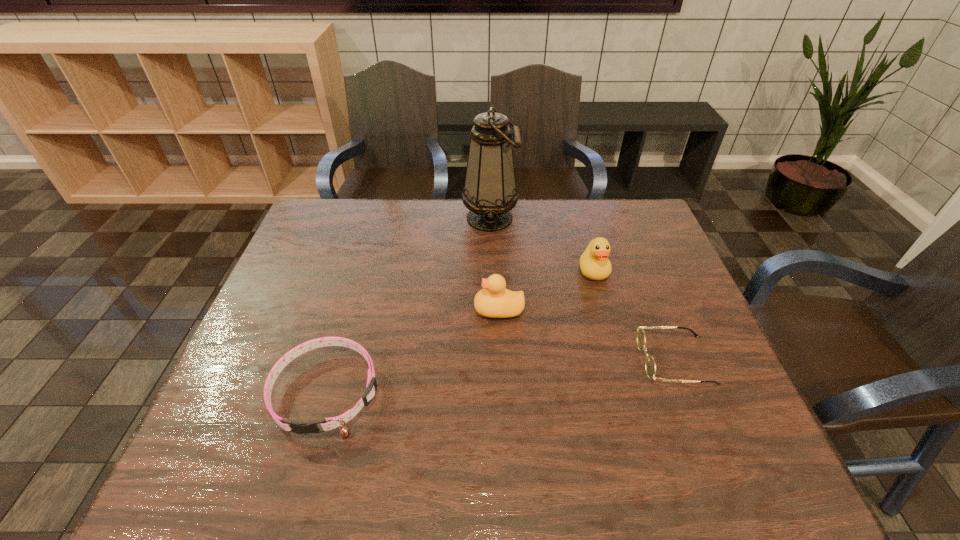
The width and height of the screenshot is (960, 540). I want to click on vacant space at the far edge, so click(x=503, y=233).

Locate an element on the screen. Image resolution: width=960 pixels, height=540 pixels. free space at the near edge of the desktop is located at coordinates (486, 485).

Locate an element on the screen. Image resolution: width=960 pixels, height=540 pixels. vacant space at the left edge of the desktop is located at coordinates point(304,305).

In the image, there is a desktop. At what (x,y) coordinates should I click in order to perform the action: click on free space at the right edge. Please return your answer as a coordinate pair (x, y). Image resolution: width=960 pixels, height=540 pixels. Looking at the image, I should click on (701, 409).

The width and height of the screenshot is (960, 540). I want to click on vacant space at the far left corner, so pos(313,231).

Locate an element on the screen. This screenshot has height=540, width=960. vacant space at the far right corner of the desktop is located at coordinates (644, 226).

You are a GUI agent. You are given a task and a screenshot of the screen. Output one action in this format:
    pyautogui.click(x=<x>, y=<y>)
    Task: Click on the vacant area that lies between the rightmost object and the dog collar
    
    Given the screenshot: What is the action you would take?
    pyautogui.click(x=501, y=376)

At what (x,y) coordinates should I click in order to perform the action: click on vacant space that is in between the third farthest object and the tallest object. Please return your answer as a coordinate pair (x, y). This screenshot has height=540, width=960. Looking at the image, I should click on (494, 264).

The width and height of the screenshot is (960, 540). Find the location of `free space that is in between the spectacles and the oil lamp`. free space that is in between the spectacles and the oil lamp is located at coordinates (582, 289).

At what (x,y) coordinates should I click in order to perform the action: click on vacant area that lies between the oil lamp and the spectacles. Please return your answer as a coordinate pair (x, y). This screenshot has width=960, height=540. Looking at the image, I should click on (582, 289).